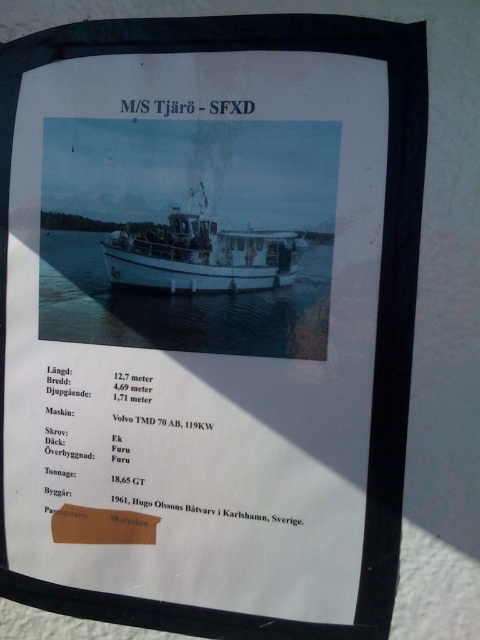
Question: Which point is closer to the camera?

Choices:
 (A) (154, 348)
 (B) (201, 218)

Answer: (B)

Question: Can you confirm if clear blue water at center is wider than white matte boat at center?

Choices:
 (A) no
 (B) yes

Answer: (B)

Question: Which object appears closest to the camera in this image?

Choices:
 (A) white matte boat at center
 (B) clear blue water at center

Answer: (B)

Question: Does clear blue water at center lie in front of white matte boat at center?

Choices:
 (A) yes
 (B) no

Answer: (A)

Question: Is clear blue water at center below white matte boat at center?

Choices:
 (A) yes
 (B) no

Answer: (A)